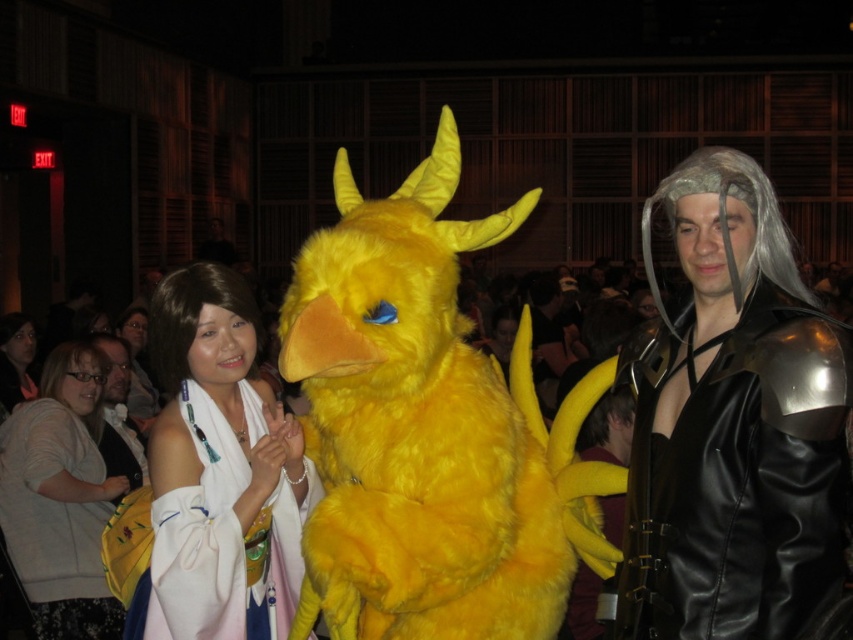
Does white fabric at lower left have a larger size compared to brown synthetic wig at lower left?

Correct, white fabric at lower left is larger in size than brown synthetic wig at lower left.

Which is below, white fabric at lower left or brown synthetic wig at lower left?

white fabric at lower left is lower down.

Where is `white fabric at lower left`? white fabric at lower left is located at coordinates point(61,499).

Does brown synthetic wig at center have a greater height compared to matte black wig at left?

No.

Can you confirm if brown synthetic wig at center is smaller than matte black wig at left?

Yes.

Does point (254, 305) come behind point (144, 468)?

No.

The height and width of the screenshot is (640, 853). In order to click on brown synthetic wig at center in this screenshot , I will do `click(190, 314)`.

How far apart are shiny silver armor at right and white satin kimono at center?

shiny silver armor at right is 1.54 meters away from white satin kimono at center.

Who is more forward, (648,230) or (286,444)?

Point (286,444)

Locate an element on the screen. This screenshot has height=640, width=853. shiny silver armor at right is located at coordinates (732, 422).